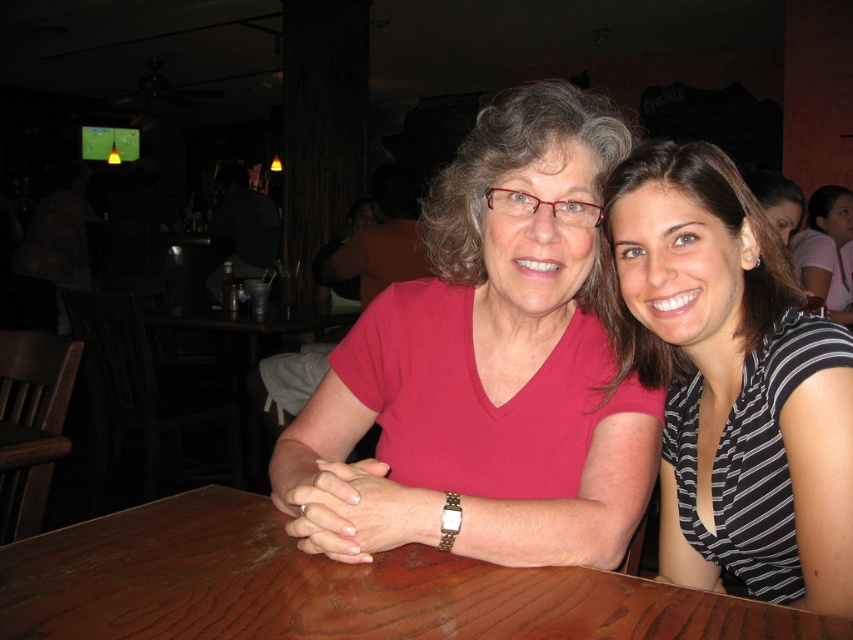
Between matte pink shirt at center and striped fabric shirt at center, which one appears on the left side from the viewer's perspective?

Positioned to the left is matte pink shirt at center.

Which is above, matte pink shirt at center or striped fabric shirt at center?

matte pink shirt at center is higher up.

Does point (635, 384) lie behind point (779, 253)?

No.

Identify the location of matte pink shirt at center. Image resolution: width=853 pixels, height=640 pixels. (486, 368).

Does matte pink shirt at center come behind brown wood table at center?

Yes, it is behind brown wood table at center.

Where is `matte pink shirt at center`? matte pink shirt at center is located at coordinates (486, 368).

Which is in front, point (555, 499) or point (64, 608)?

Positioned in front is point (64, 608).

This screenshot has width=853, height=640. What are the coordinates of `matte pink shirt at center` in the screenshot? It's located at (486, 368).

How far apart are striped fabric shirt at center and brown wood table at center?

They are 37.85 centimeters apart.

Between striped fabric shirt at center and brown wood table at center, which one is positioned higher?

striped fabric shirt at center

Who is more forward, (697, 572) or (815, 637)?

Positioned in front is point (815, 637).

The image size is (853, 640). In order to click on striped fabric shirt at center in this screenshot , I will do `click(735, 381)`.